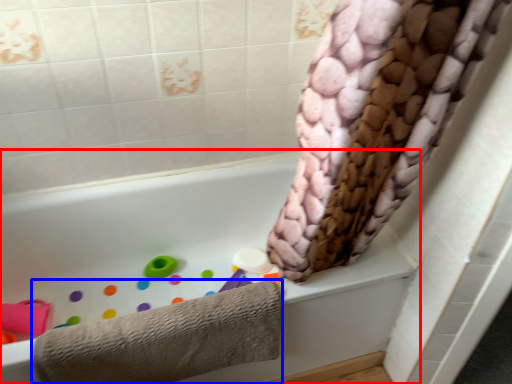
Question: Which object appears farthest to the camera in this image, bathtub (highlighted by a red box) or towel (highlighted by a blue box)?

Choices:
 (A) bathtub
 (B) towel

Answer: (B)